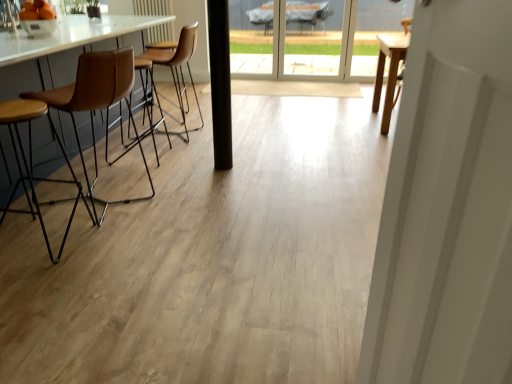
Identify the location of free space behind brown leather stool at left, positioned as the second chair in front-to-back order. (136, 163).